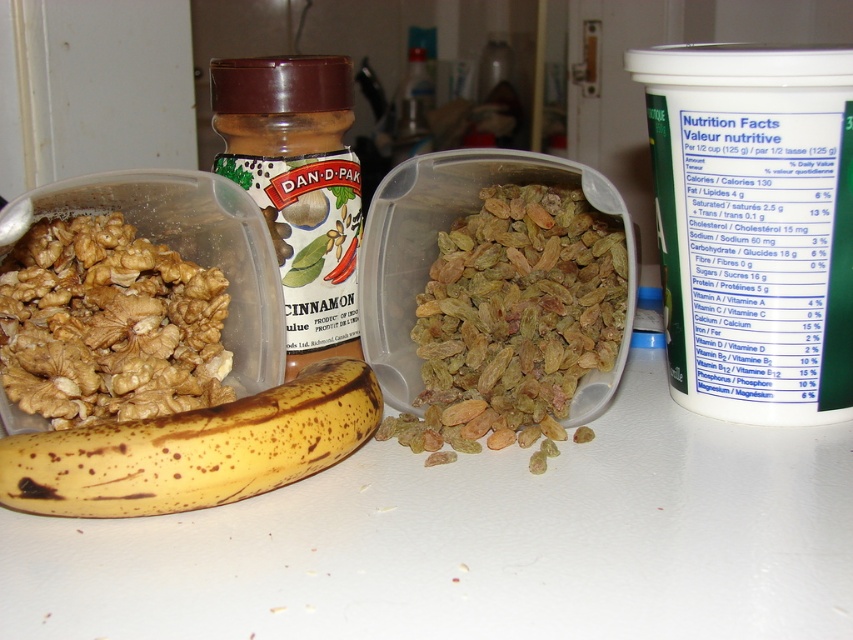
You are a chef preparing a fruit salad and need to place the light brown dried at center and the yellow spotted banana at lower left into a bowl. The bowl is placed exactly halfway between them. How far will you have to move each item to the bowl?

The light brown dried at center is 5.13 inches away from the yellow spotted banana at lower left. Since the bowl is halfway between them, each item will need to be moved 2.565 inches to reach the bowl.

You are organizing a picnic basket and need to stack items from bottom to top. Given the arrangement in the image, which item should go first at the bottom when stacking the light brown dried at center and the brown textured walnut at left?

The brown textured walnut at left should be placed at the bottom because the light brown dried at center is above it in the image.